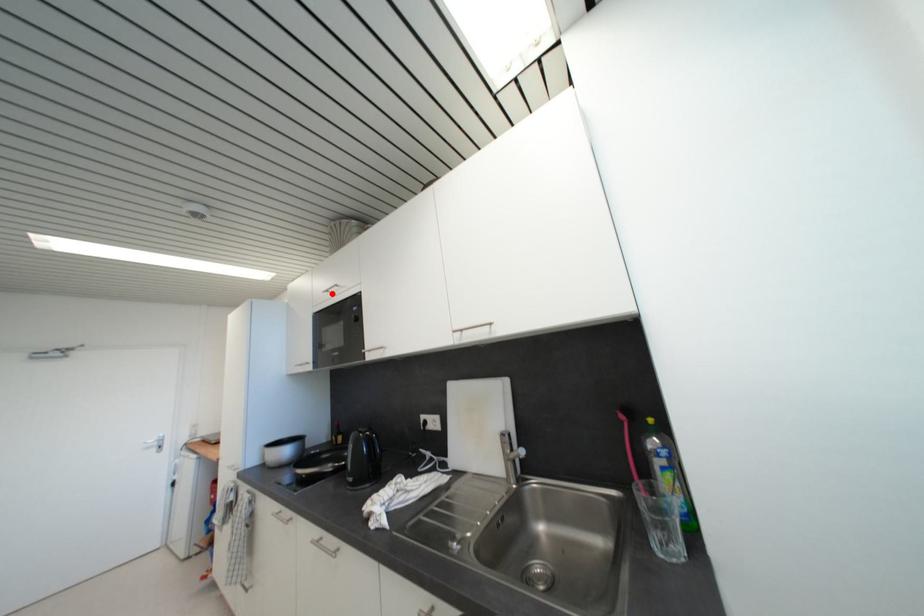
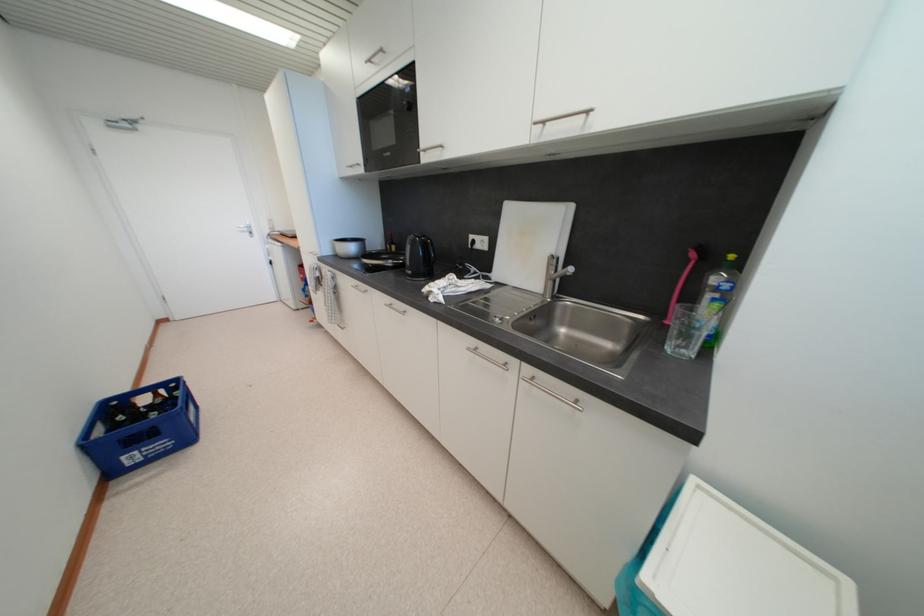
Question: I am providing you with two images of the same scene from different viewpoints. A red point is marked on the first image. Can you still see the location of the red point in image 2?

Choices:
 (A) Yes
 (B) No

Answer: (A)